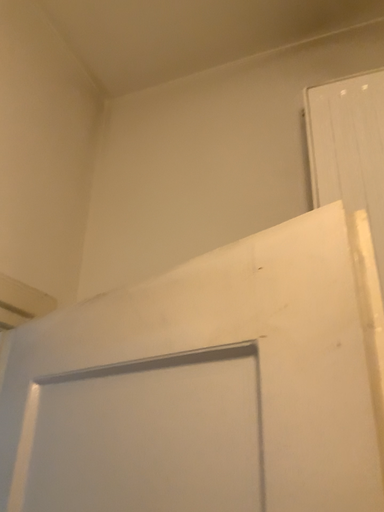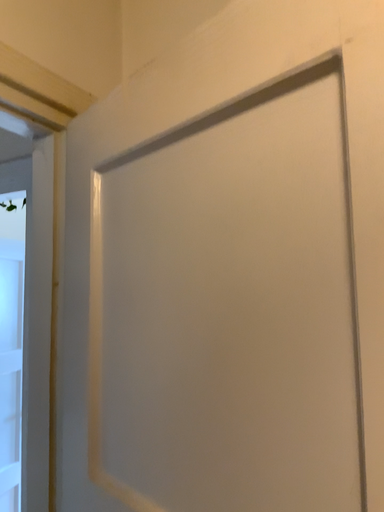
Question: How did the camera likely rotate when shooting the video?

Choices:
 (A) rotated upward
 (B) rotated downward

Answer: (B)